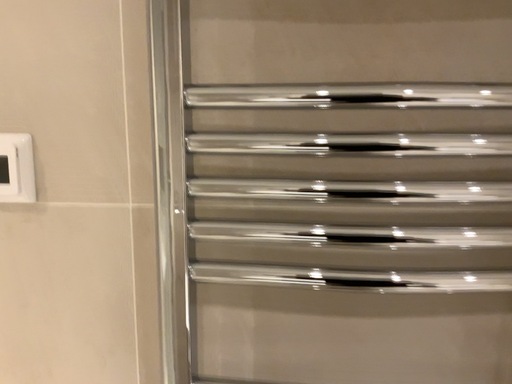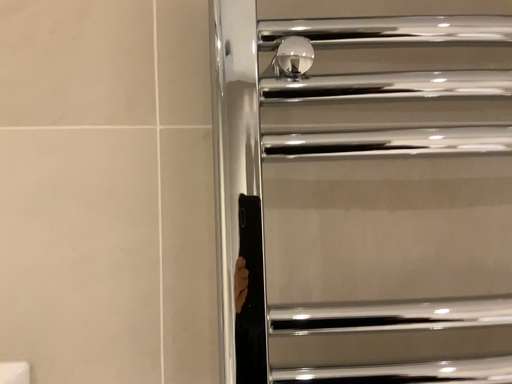
Question: Which way did the camera rotate in the video?

Choices:
 (A) rotated upward
 (B) rotated downward

Answer: (A)